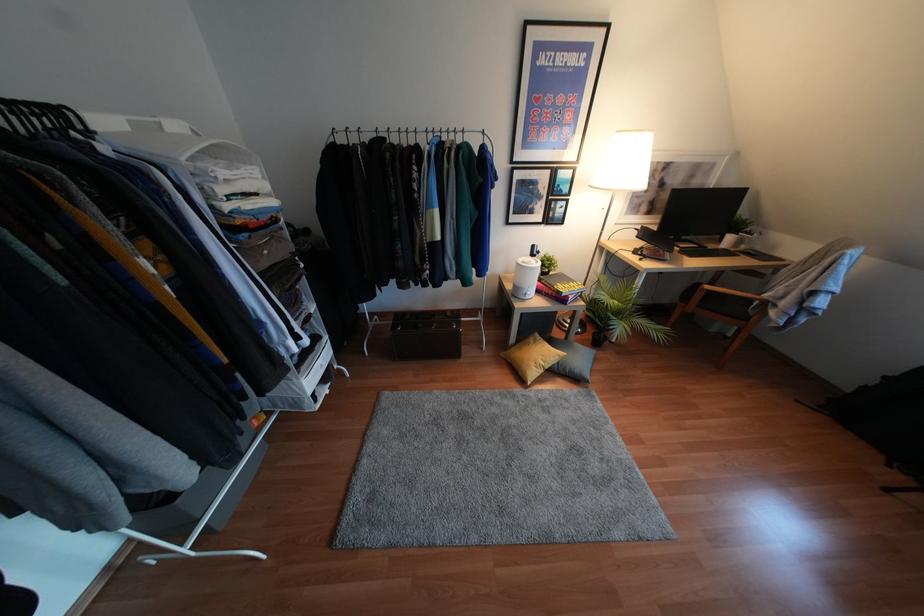
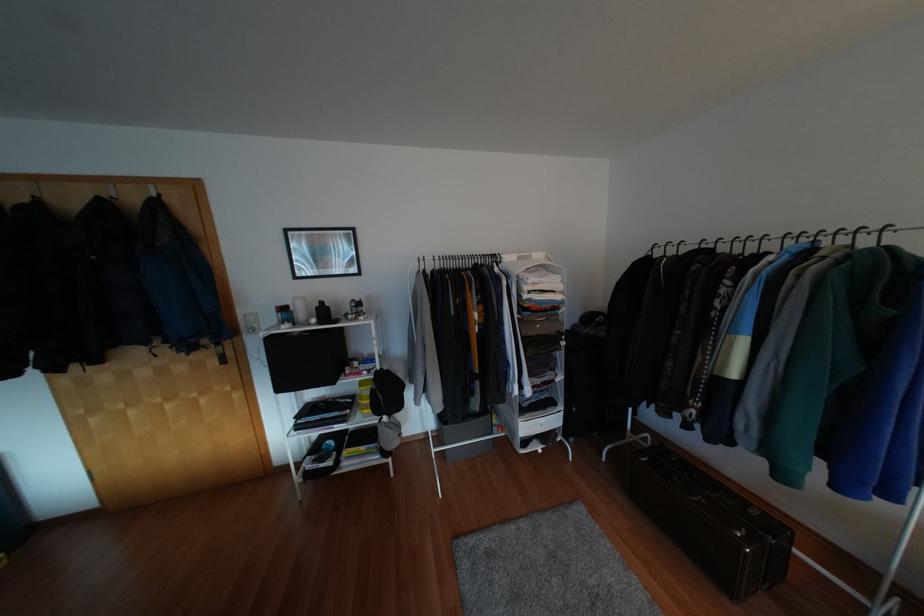
Question: The camera is either moving clockwise (left) or counter-clockwise (right) around the object. The first image is from the beginning of the video and the second image is from the end. Is the camera moving left or right when shooting the video?

Choices:
 (A) Left
 (B) Right

Answer: (B)